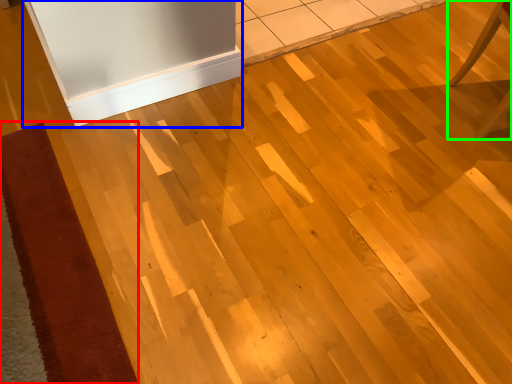
Question: Estimate the real-world distances between objects in this image. Which object is farther from doormat (highlighted by a red box), fridge (highlighted by a blue box) or furniture (highlighted by a green box)?

Choices:
 (A) fridge
 (B) furniture

Answer: (B)